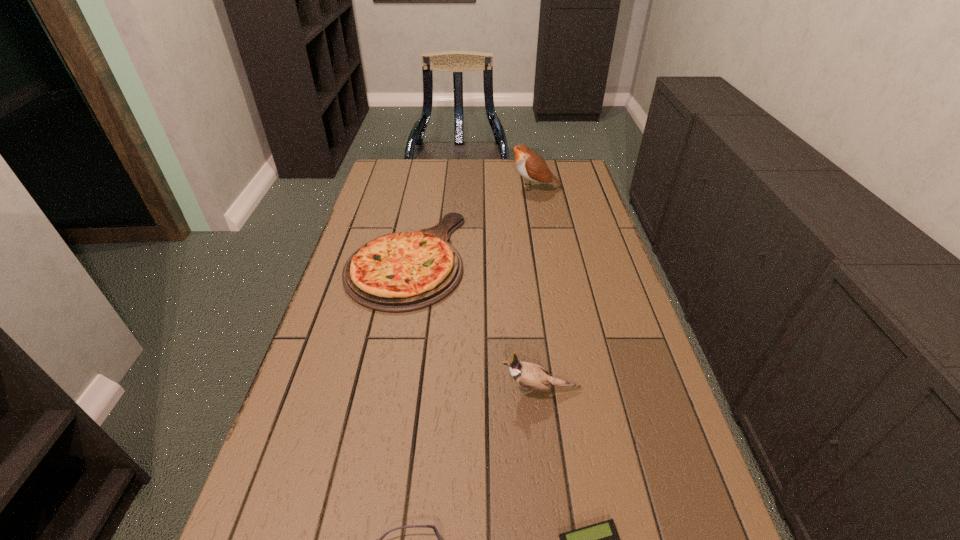
This screenshot has width=960, height=540. What are the coordinates of `free space at the far right corner of the desktop` in the screenshot? It's located at (554, 174).

At what (x,y) coordinates should I click in order to perform the action: click on vacant space in between the shorter bird and the third shortest object. Please return your answer as a coordinate pair (x, y). Looking at the image, I should click on (473, 323).

Identify which object is the second closest to the second shortest object. Please provide its 2D coordinates. Your answer should be formatted as a tuple, i.e. [(x, y)], where the tuple contains the x and y coordinates of a point satisfying the conditions above.

[(529, 375)]

Identify which object is the second closest to the second tallest object. Please provide its 2D coordinates. Your answer should be formatted as a tuple, i.e. [(x, y)], where the tuple contains the x and y coordinates of a point satisfying the conditions above.

[(601, 539)]

Find the location of a particular element. The image size is (960, 540). free point that satisfies the following two spatial constraints: 1. at the face of the farthest object; 2. on the front side of the fourth nearest object is located at coordinates (548, 258).